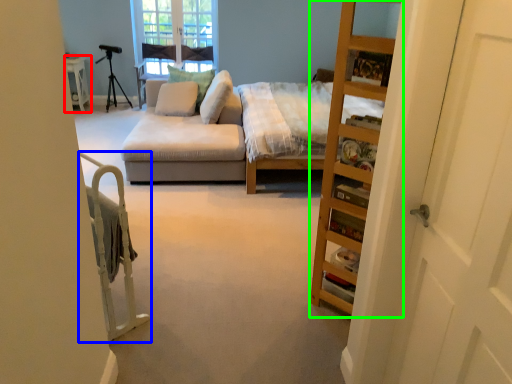
Question: Which is nearer to the table (highlighted by a red box)? bed frame (highlighted by a blue box) or cabinet (highlighted by a green box).

Choices:
 (A) bed frame
 (B) cabinet

Answer: (A)